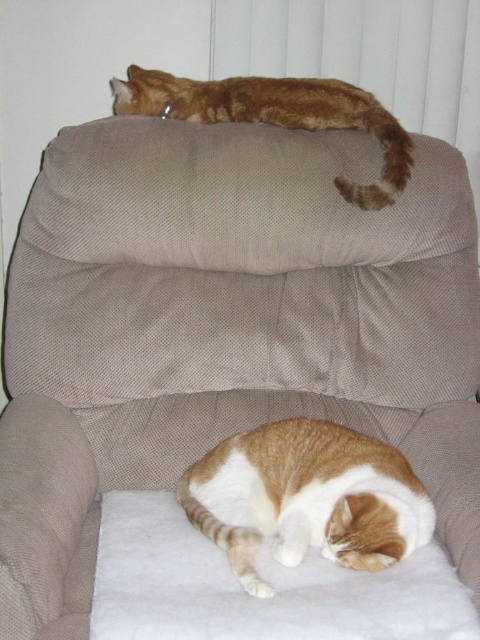
The image size is (480, 640). What do you see at coordinates (307, 497) in the screenshot? I see `orange-white fur cat at lower center` at bounding box center [307, 497].

Can you confirm if orange-white fur cat at lower center is taller than orange fur cat at upper center?

Incorrect, orange-white fur cat at lower center's height is not larger of orange fur cat at upper center's.

Where is `orange-white fur cat at lower center`? orange-white fur cat at lower center is located at coordinates (307, 497).

You are a GUI agent. You are given a task and a screenshot of the screen. Output one action in this format:
    pyautogui.click(x=<x>, y=<y>)
    Task: Click on the orange-white fur cat at lower center
    The height and width of the screenshot is (640, 480).
    Given the screenshot: What is the action you would take?
    pyautogui.click(x=307, y=497)